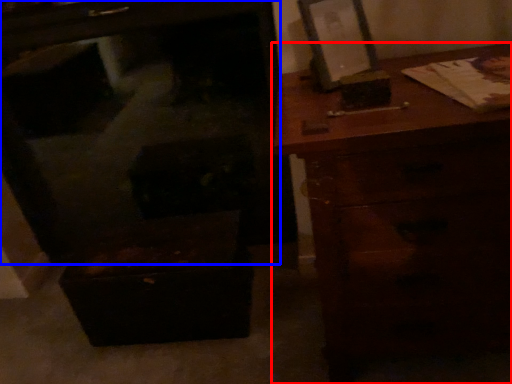
Question: Which of the following is the closest to the observer, chest of drawers (highlighted by a red box) or furniture (highlighted by a blue box)?

Choices:
 (A) chest of drawers
 (B) furniture

Answer: (A)